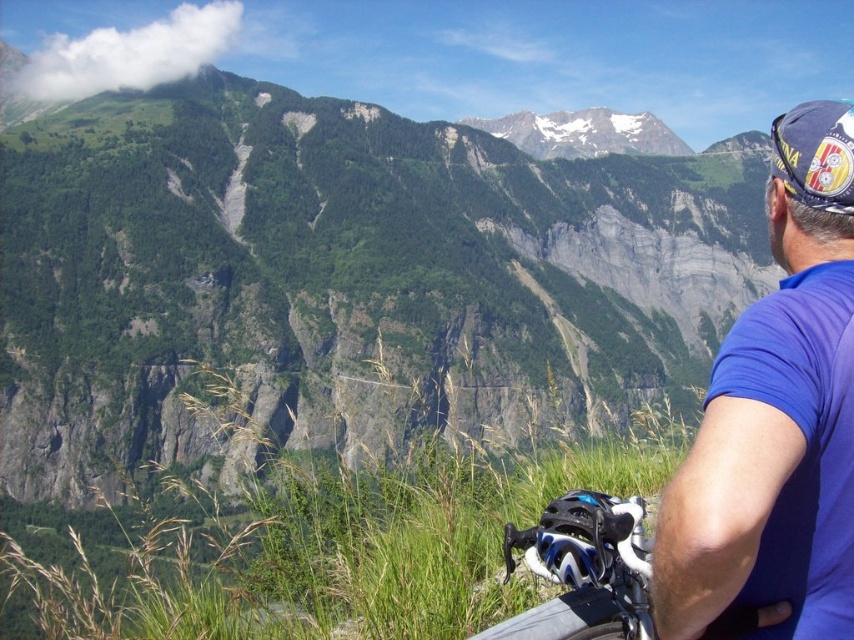
Is green rock at center below white snow-covered mountain at upper center?

Yes.

Is green rock at center positioned behind white snow-covered mountain at upper center?

That is False.

The height and width of the screenshot is (640, 854). In order to click on green rock at center in this screenshot , I will do `click(341, 275)`.

In the scene shown: Is the position of green rock at center more distant than that of blue fabric shirt at right?

That is True.

You are a GUI agent. You are given a task and a screenshot of the screen. Output one action in this format:
    pyautogui.click(x=<x>, y=<y>)
    Task: Click on the green rock at center
    
    Given the screenshot: What is the action you would take?
    pyautogui.click(x=341, y=275)

Which of these two, blue fabric shirt at right or white snow-covered mountain at upper center, stands shorter?

With less height is white snow-covered mountain at upper center.

Locate an element on the screen. This screenshot has width=854, height=640. blue fabric shirt at right is located at coordinates (775, 424).

Locate an element on the screen. This screenshot has height=640, width=854. blue fabric shirt at right is located at coordinates (775, 424).